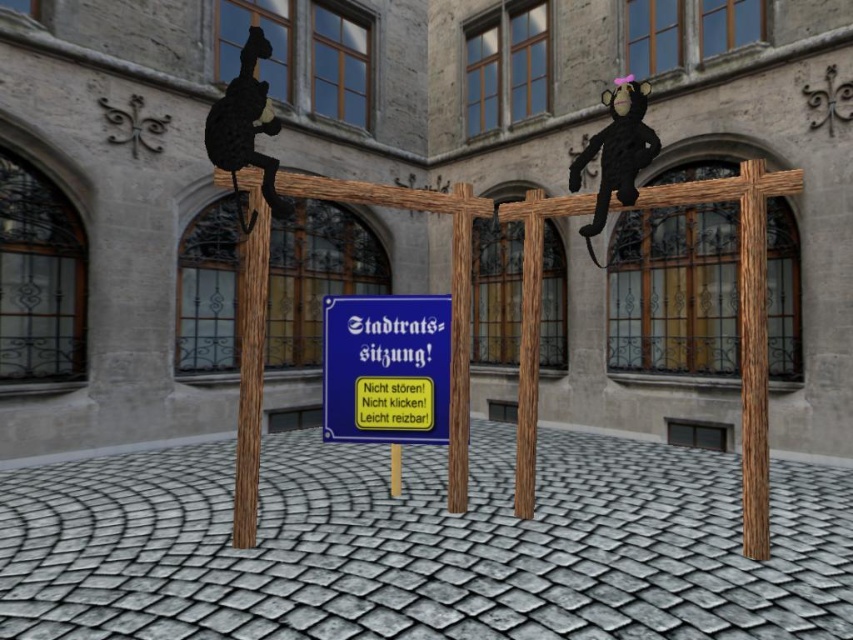
Question: From the image, what is the correct spatial relationship of wooden pole at right in relation to black matte cat at upper left?

Choices:
 (A) left
 (B) right

Answer: (B)

Question: Does black matte cat at upper left lie behind brown wood pole at center?

Choices:
 (A) yes
 (B) no

Answer: (B)

Question: Which object appears closest to the camera in this image?

Choices:
 (A) wooden pole at left
 (B) brown wood pole at center
 (C) wooden pole at center

Answer: (A)

Question: Which object is positioned farthest from the wooden pole at right?

Choices:
 (A) wooden pole at left
 (B) brown wood pole at center
 (C) wooden pole at center
 (D) black matte cat at upper left

Answer: (A)

Question: Which object is closer to the camera taking this photo?

Choices:
 (A) wooden pole at left
 (B) brown wood pole at center
 (C) blue painted wood sign at center
 (D) black matte cat at upper left

Answer: (D)

Question: From the image, what is the correct spatial relationship of brown wood pole at center in relation to wooden pole at center?

Choices:
 (A) below
 (B) above

Answer: (A)